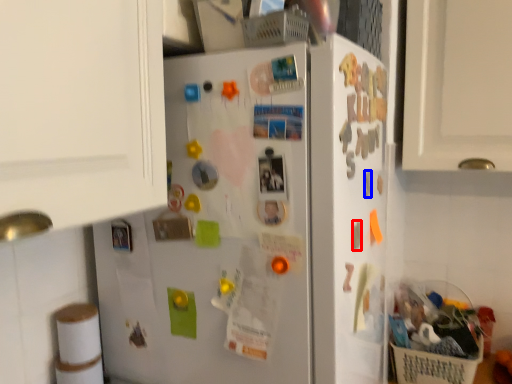
Question: Among these objects, which one is farthest to the camera, magnet (highlighted by a red box) or magnet (highlighted by a blue box)?

Choices:
 (A) magnet
 (B) magnet

Answer: (B)